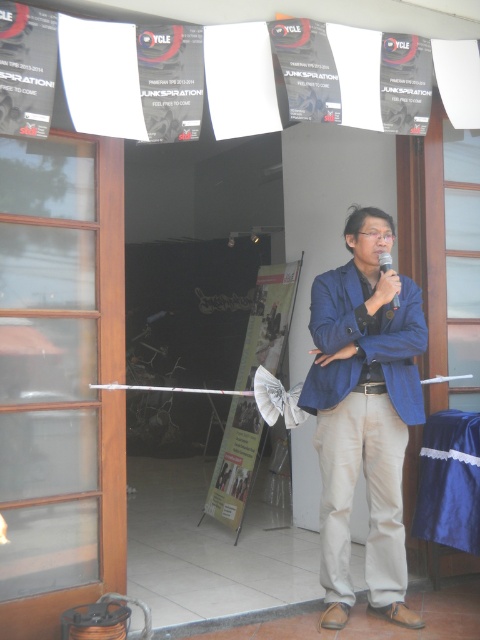
You are organizing a conference and need to pack the equipment. The matte blue jacket at center and the black plastic microphone at center are both on the table. Which item requires more space in the storage box?

The matte blue jacket at center requires more space in the storage box because it is bigger than the black plastic microphone at center.

You are a photographer setting up for an event. You need to position a 1.8m tall tripod so that it doesn not block the view through the clear glass door at left and the white fabric poster at center. Given that the tripod will occupy space, which object should you place the tripod closer to?

The clear glass door at left is much taller than the white fabric poster at center, so placing the tripod closer to the white fabric poster at center would be better to avoid blocking the view through the taller door.